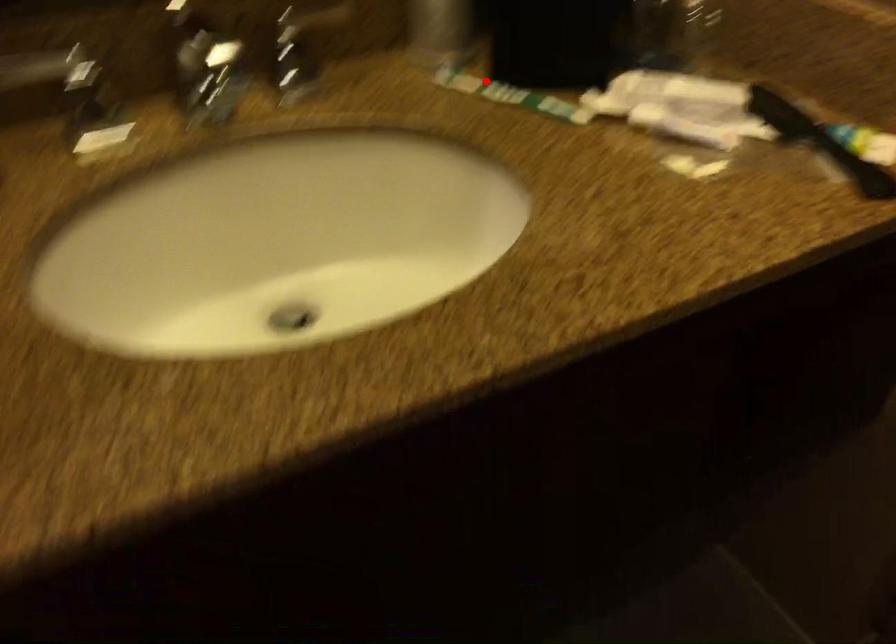
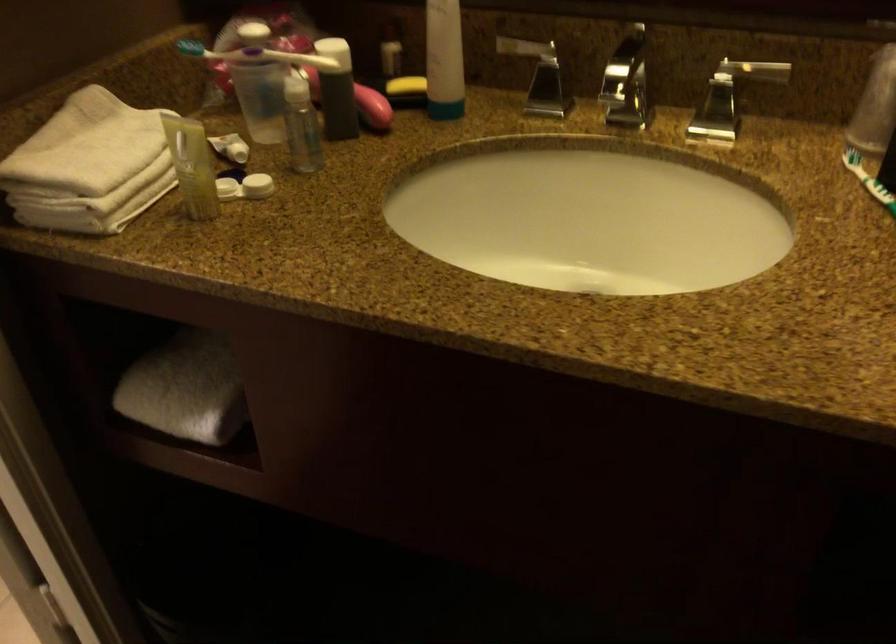
Locate, in the second image, the point that corresponds to the highlighted location in the first image.

(867, 180)